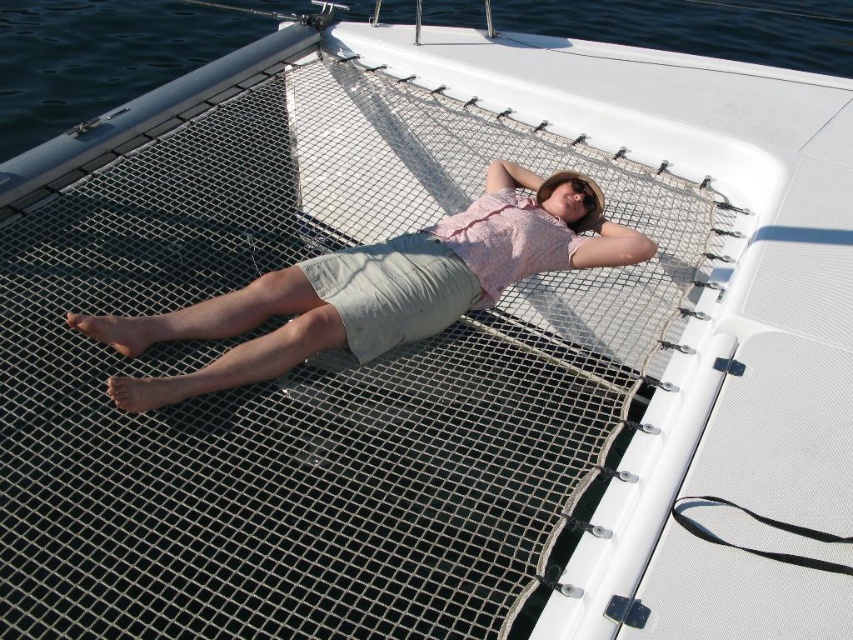
From the picture: You are a photographer trying to capture a closeup of the person on the catamaran boat. You have two points marked on your viewfinder at coordinates point (471, 230) and point (793, 10). Which point should you focus on to get the closest detail of the person?

Point (471, 230) is closer to the camera than point (793, 10), so you should focus on point (471, 230) to capture the closest detail of the person.

You are a photographer planning to take a portrait of the person on the catamaran boat. You want to focus on the pink fabric shirt at center. Which direction should you move your camera to align the shirt with the boat deck? The boat deck is white.

The pink fabric shirt at center is located at point (x=380, y=285). Since the boat deck is white and the shirt is pink, moving the camera towards the center coordinates will align the shirt with the deck background.

You are a photographer trying to capture the scene of the person relaxing on the catamaran. You want to ensure that both the pink fabric shirt at center and the transparent water at upper left are visible in your shot. Based on their positions, which object is closer to the left edge of the photo?

The pink fabric shirt at center is to the left of transparent water at upper left, so the pink fabric shirt at center is closer to the left edge of the photo.